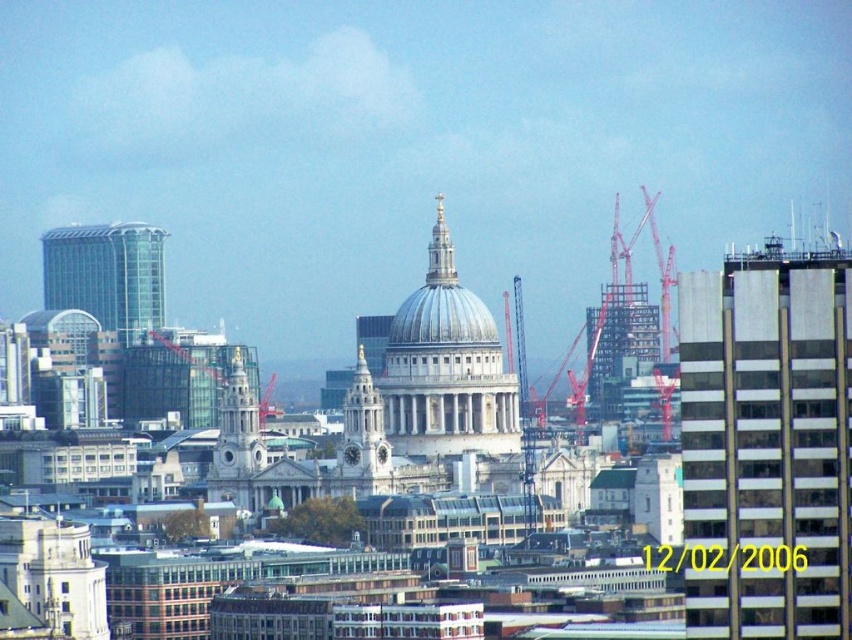
Question: Is white marble dome at center below transparent glass tower at left?

Choices:
 (A) no
 (B) yes

Answer: (B)

Question: Which point appears farthest from the camera in this image?

Choices:
 (A) [x=413, y=385]
 (B) [x=738, y=285]
 (C) [x=91, y=244]

Answer: (C)

Question: Does white marble dome at center have a smaller size compared to shiny silver dome at center?

Choices:
 (A) no
 (B) yes

Answer: (A)

Question: Which point is closer to the camera?

Choices:
 (A) glassy reflective building at right
 (B) shiny silver dome at center
 (C) transparent glass tower at left
 (D) white marble dome at center

Answer: (B)

Question: Which object is positioned farthest from the glassy reflective building at right?

Choices:
 (A) white marble dome at center
 (B) shiny silver dome at center

Answer: (B)

Question: Considering the relative positions of glassy reflective building at right and transparent glass tower at left in the image provided, where is glassy reflective building at right located with respect to transparent glass tower at left?

Choices:
 (A) right
 (B) left

Answer: (A)